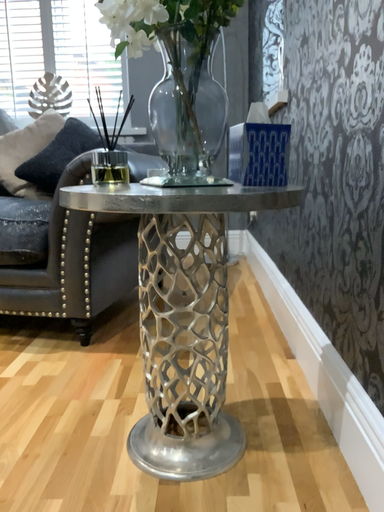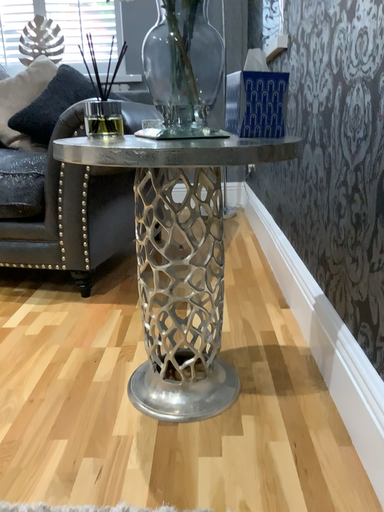
Question: How did the camera likely rotate when shooting the video?

Choices:
 (A) rotated downward
 (B) rotated upward

Answer: (A)